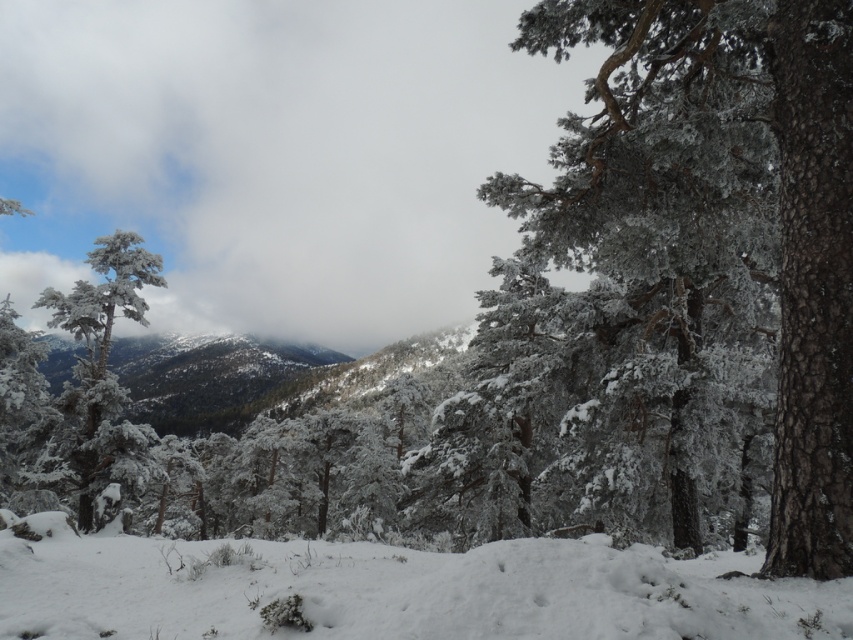
Question: Which point appears farthest from the camera in this image?

Choices:
 (A) (263, 381)
 (B) (128, 232)
 (C) (508, 620)
 (D) (32, 67)

Answer: (D)

Question: Considering the relative positions of white fluffy cloud at upper center and white frosty tree at left in the image provided, where is white fluffy cloud at upper center located with respect to white frosty tree at left?

Choices:
 (A) above
 (B) below

Answer: (A)

Question: Does white fluffy snow at lower center appear on the left side of snowy evergreen forest at left?

Choices:
 (A) no
 (B) yes

Answer: (A)

Question: Among these objects, which one is nearest to the camera?

Choices:
 (A) white fluffy snow at lower center
 (B) snowy evergreen forest at left
 (C) white frosty tree at left
 (D) white fluffy cloud at upper center

Answer: (A)

Question: Observing the image, what is the correct spatial positioning of white fluffy cloud at upper center in reference to white fluffy snow at lower center?

Choices:
 (A) below
 (B) above

Answer: (B)

Question: Among these objects, which one is farthest from the camera?

Choices:
 (A) white frosty tree at left
 (B) white fluffy snow at lower center
 (C) white fluffy cloud at upper center

Answer: (C)